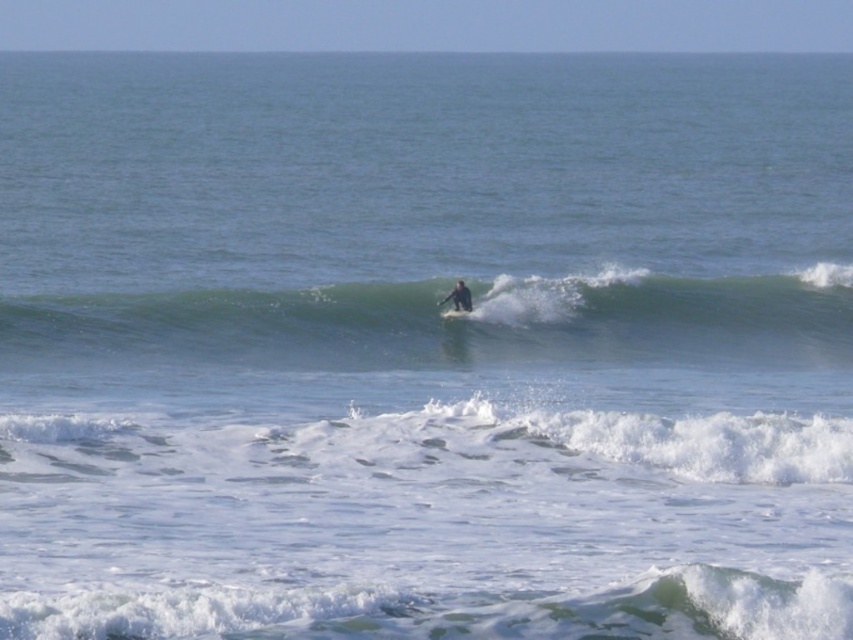
Question: Can you confirm if dark blue wetsuit at center is smaller than white foam surfboard at center?

Choices:
 (A) no
 (B) yes

Answer: (A)

Question: Which is nearer to the white frothy wave at lower center?

Choices:
 (A) green rubber surfboard at center
 (B) white foam surfboard at center

Answer: (A)

Question: Which point is farther to the camera?

Choices:
 (A) dark blue wetsuit at center
 (B) white frothy wave at lower center
 (C) white foam surfboard at center

Answer: (A)

Question: Can you confirm if green rubber surfboard at center is positioned to the right of white foam surfboard at center?

Choices:
 (A) no
 (B) yes

Answer: (B)

Question: Which object is positioned closest to the white foam surfboard at center?

Choices:
 (A) dark blue wetsuit at center
 (B) green rubber surfboard at center
 (C) white frothy wave at lower center

Answer: (A)

Question: Observing the image, what is the correct spatial positioning of green rubber surfboard at center in reference to white frothy wave at lower center?

Choices:
 (A) above
 (B) below

Answer: (A)